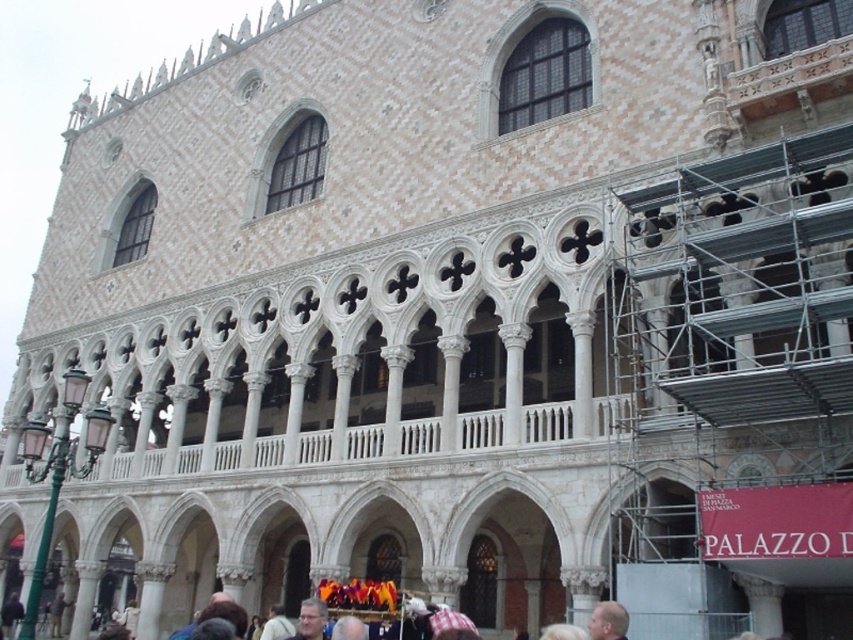
You are a construction worker standing in front of the PALAZZO building. You notice two people nearby. One has blonde hair at lower right and the other has gray hair at center. Which person has a smaller head size?

The blonde hair at lower right is smaller than gray hair at center, so the person with blonde hair at lower right has a smaller head size.

You are standing in front of the historic building and want to take a photo of the scaffolding on the right side. You notice a point at coordinates point (x=607, y=611) that is 117.37 feet away from you. Can you estimate how far the scaffolding is from your current position?

The distance of point (x=607, y=611) from viewer is 117.37 feet, so the scaffolding on the right side is approximately 117.37 feet away from your current position.